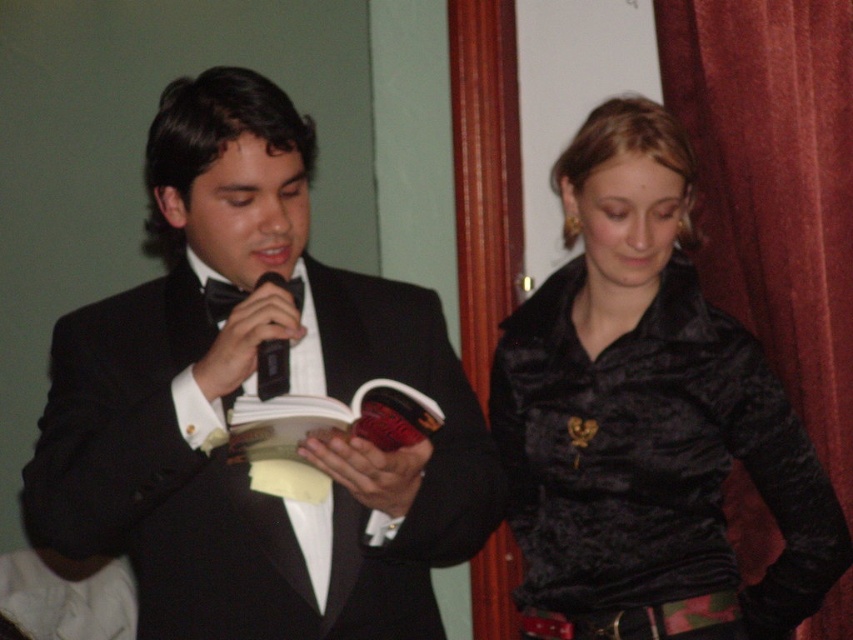
You are organizing a charity event and need to ensure that all items displayed are appropriately sized for their designated spaces. The black satin tuxedo at center will be placed on a mannequin, and the black satin bow tie at upper left will be displayed in a small glass case. Given their sizes, which item requires a larger display area?

The black satin tuxedo at center requires a larger display area because it is larger in size than the black satin bow tie at upper left.

You are a photographer setting up for a formal event. You need to ensure that the black satin tuxedo at center and the velvet red curtain at right are both visible in your photo. Based on their sizes, which object should you focus on first to frame the shot properly?

The black satin tuxedo at center has a lesser height compared to the velvet red curtain at right, so you should focus on the velvet red curtain at right first to ensure it fits within the frame since it is taller.